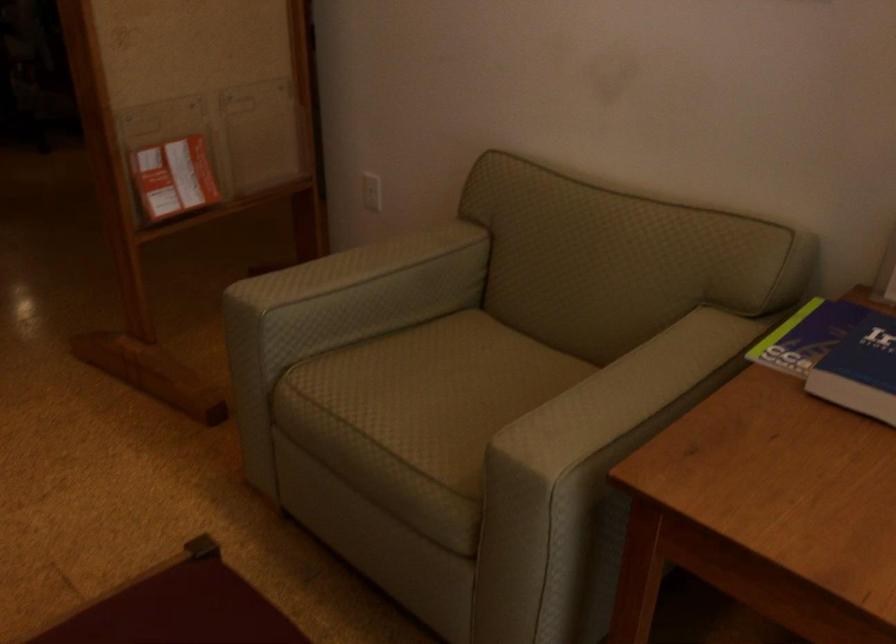
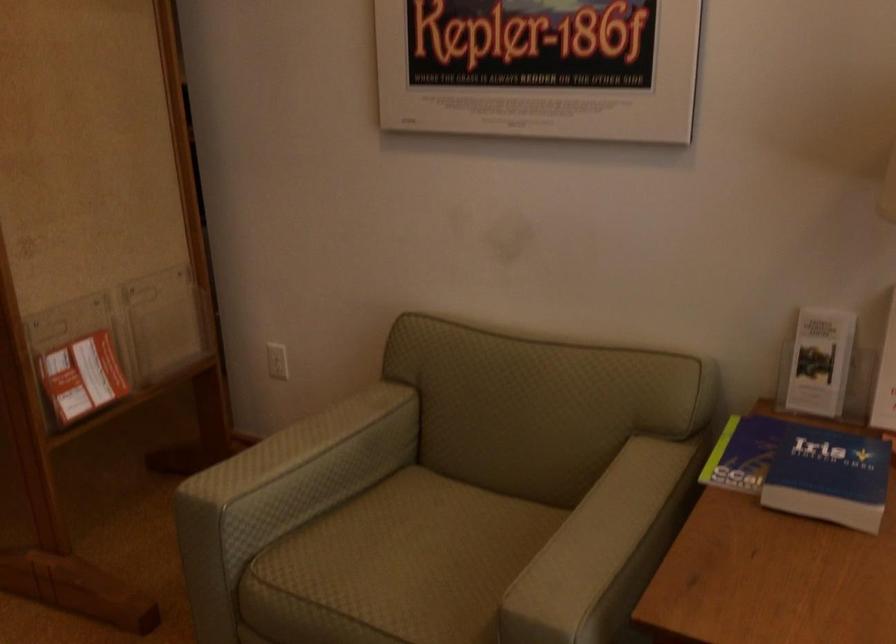
The point at (433, 393) is marked in the first image. Where is the corresponding point in the second image?

(407, 563)